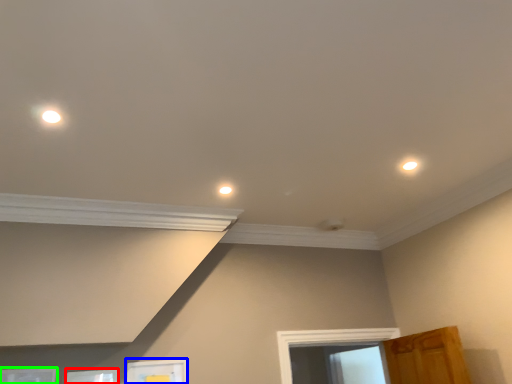
Question: Which is farther away from picture frame (highlighted by a red box)? picture frame (highlighted by a blue box) or picture frame (highlighted by a green box)?

Choices:
 (A) picture frame
 (B) picture frame

Answer: (A)